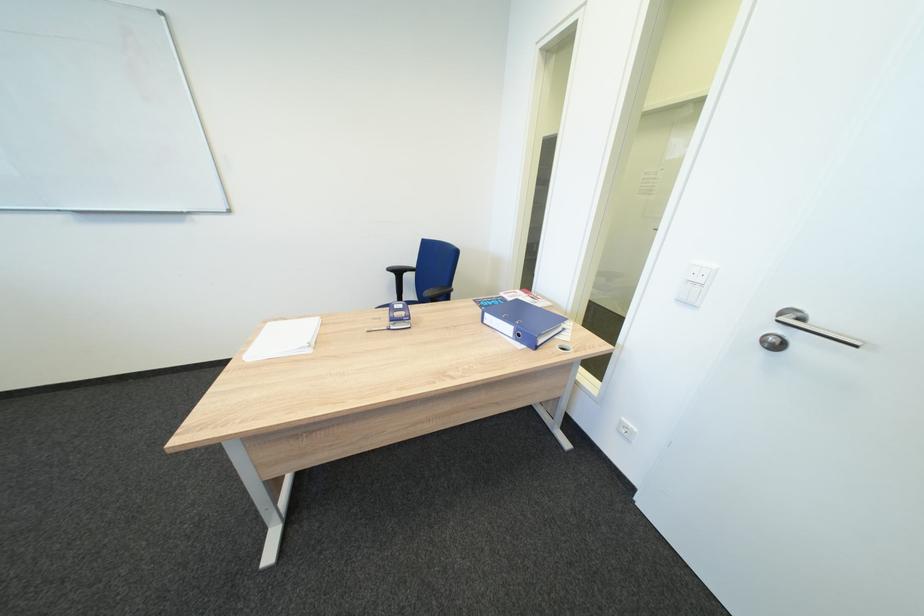
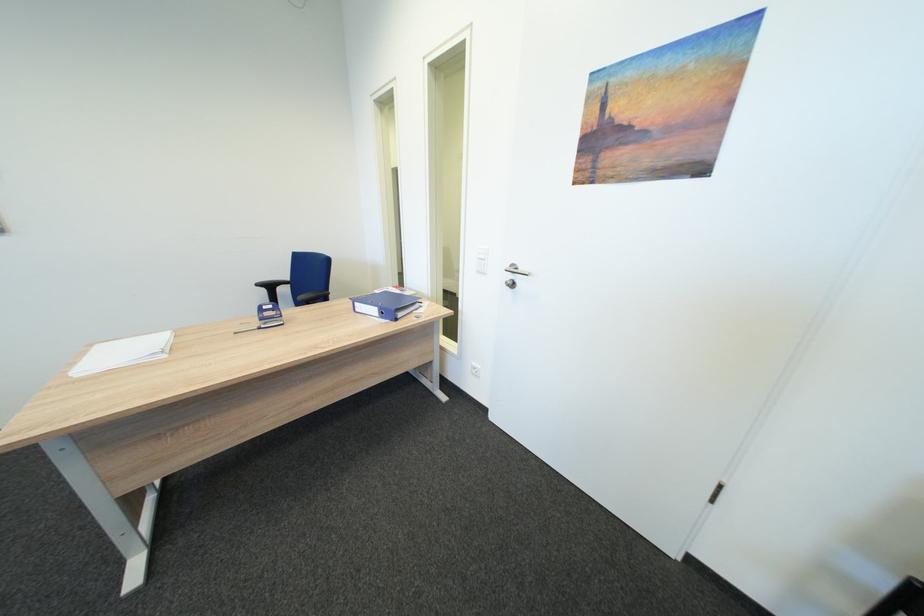
What movement of the cameraman would produce the second image?

The cameraman moved toward right, backward.